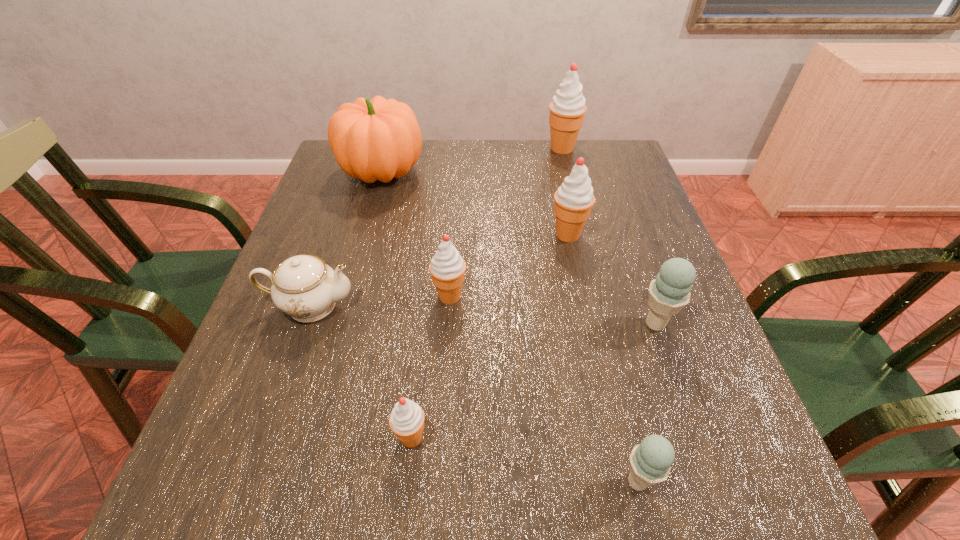
Image resolution: width=960 pixels, height=540 pixels. What are the coordinates of `free location at the left edge` in the screenshot? It's located at (267, 402).

In the image, there is a desktop. Where is `vacant region at the right edge`? This screenshot has height=540, width=960. vacant region at the right edge is located at coordinates pos(630,229).

Identify the location of free space at the far left corner of the desktop. The width and height of the screenshot is (960, 540). (334, 165).

This screenshot has height=540, width=960. What are the coordinates of `free location at the near left corner of the desktop` in the screenshot? It's located at (202, 504).

At what (x,y) coordinates should I click in order to perform the action: click on blank space at the far right corner. Please return your answer as a coordinate pair (x, y). This screenshot has width=960, height=540. Looking at the image, I should click on (586, 160).

Find the location of `free space between the second nearest red icecream and the orange pumpkin`. free space between the second nearest red icecream and the orange pumpkin is located at coordinates (416, 234).

Where is `free area in between the sixth nearest object and the rightmost object`? free area in between the sixth nearest object and the rightmost object is located at coordinates (612, 279).

The image size is (960, 540). In order to click on free space between the fifth shortest ice cream and the orange pumpkin in this screenshot , I will do `click(475, 203)`.

Locate an element on the screen. Image resolution: width=960 pixels, height=540 pixels. vacant space that is in between the chinaware and the second nearest object is located at coordinates (361, 372).

I want to click on vacant point located between the bigger blue ice cream and the left blue ice cream, so click(x=646, y=403).